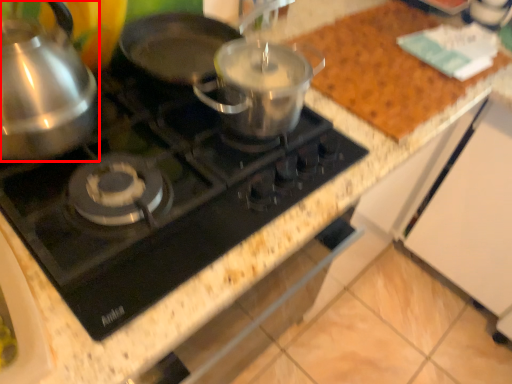
Question: In this image, where is kitchen appliance (annotated by the red box) located relative to gas stove?

Choices:
 (A) right
 (B) left

Answer: (B)